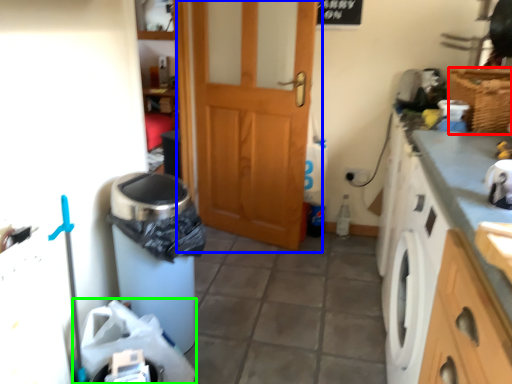
Question: Which object is positioned farthest from basket (highlighted by a red box)? Select from door (highlighted by a blue box) and garbage (highlighted by a green box).

Choices:
 (A) door
 (B) garbage

Answer: (B)